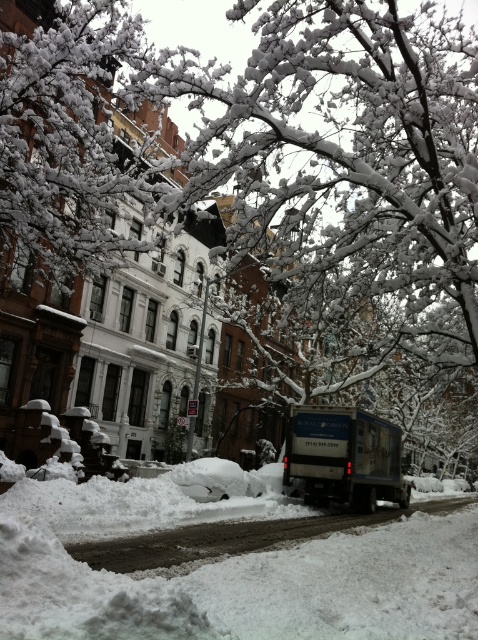
Where is `white fluffy snow at lower left`? The height and width of the screenshot is (640, 478). white fluffy snow at lower left is located at coordinates (229, 573).

Who is higher up, white fluffy snow at lower left or blue metallic truck at center?

Positioned higher is white fluffy snow at lower left.

Who is more distant from viewer, (301, 584) or (395, 458)?

The point (395, 458) is more distant.

Where is `white fluffy snow at lower left`? white fluffy snow at lower left is located at coordinates (229, 573).